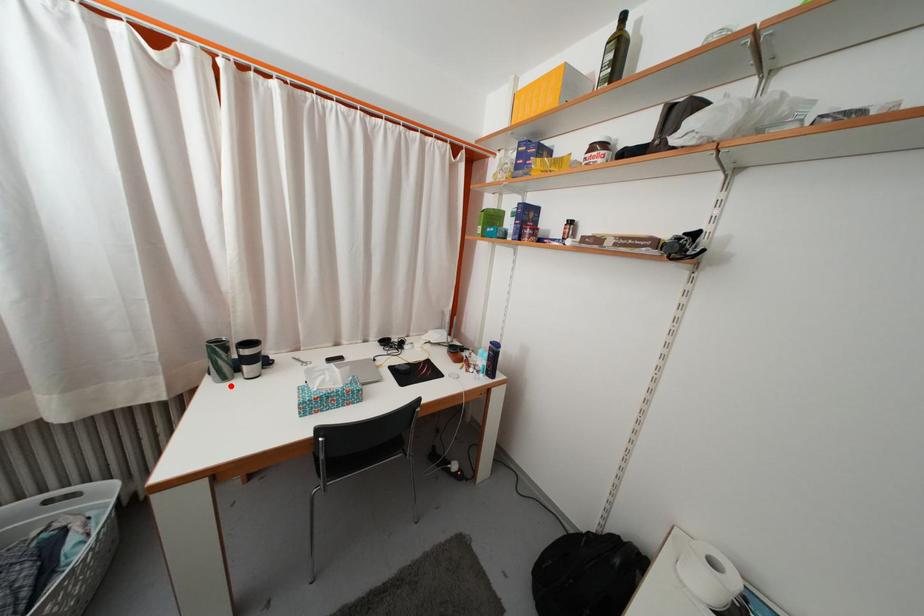
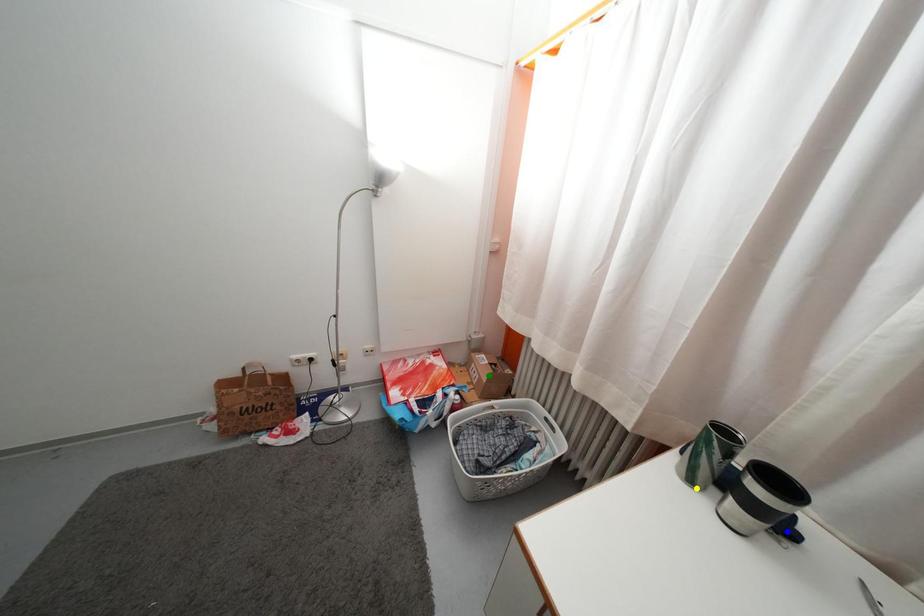
Question: I am providing you with two images of the same scene from different viewpoints. A red point is marked on the first image. You are given multiple points on the second image. Which spot in image 2 lines up with the point in image 1?

Choices:
 (A) blue point
 (B) yellow point
 (C) green point

Answer: (B)